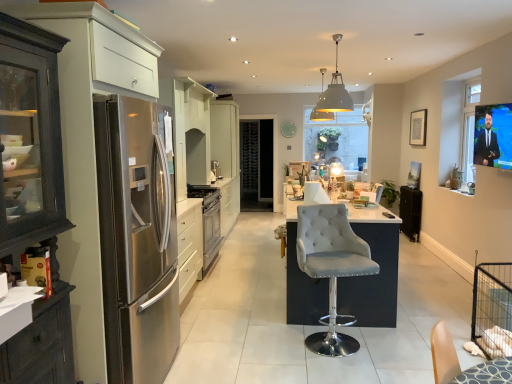
This screenshot has width=512, height=384. Find the location of `vacant area that lies in front of suede-like gray bar stool at center`. vacant area that lies in front of suede-like gray bar stool at center is located at coordinates (350, 366).